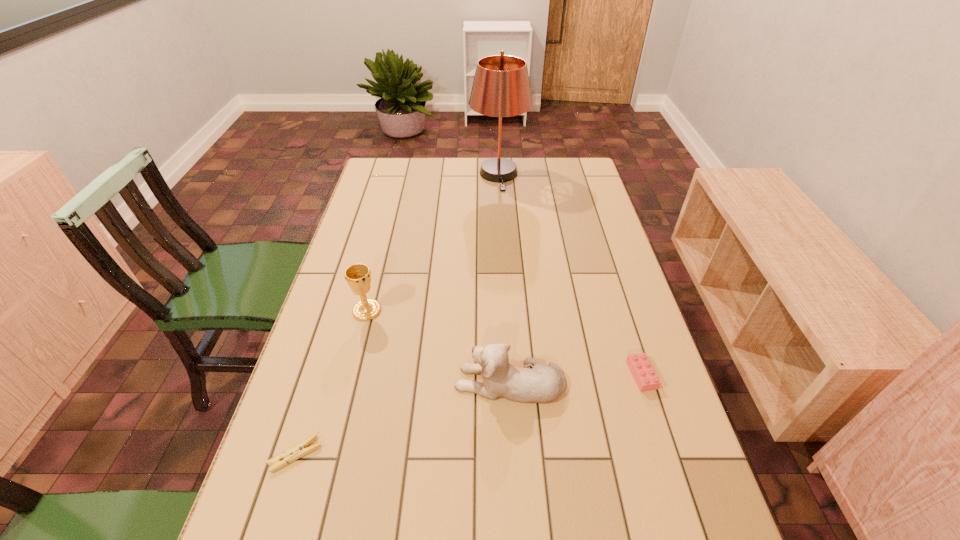
This screenshot has height=540, width=960. Find the location of `free spot at the left edge of the desktop`. free spot at the left edge of the desktop is located at coordinates (x=339, y=320).

Locate an element on the screen. Image resolution: width=960 pixels, height=540 pixels. vacant region at the right edge of the desktop is located at coordinates (574, 242).

This screenshot has width=960, height=540. In the image, there is a desktop. What are the coordinates of `vacant space at the far left corner` in the screenshot? It's located at click(x=388, y=160).

At what (x,y) coordinates should I click in order to perform the action: click on vacant space that's between the clothespin and the lampshade. Please return your answer as a coordinate pair (x, y). Looking at the image, I should click on (397, 315).

Locate an element on the screen. blank region between the farthest object and the chalice is located at coordinates (433, 242).

The height and width of the screenshot is (540, 960). In order to click on vacant point located between the chalice and the puppy in this screenshot , I will do `click(438, 346)`.

The image size is (960, 540). In order to click on vacant area that lies between the puppy and the clothespin in this screenshot , I will do `click(403, 418)`.

You are a GUI agent. You are given a task and a screenshot of the screen. Output one action in this format:
    pyautogui.click(x=<x>, y=<y>)
    Task: Click on the vacant space that is in between the nearest object and the lampshade
    This screenshot has width=960, height=540.
    Given the screenshot: What is the action you would take?
    pyautogui.click(x=397, y=315)

Identify the location of vacant space that is in between the lampshade and the puppy. (504, 278).

This screenshot has height=540, width=960. In order to click on blank region between the chalice and the farthest object in this screenshot , I will do `click(433, 242)`.